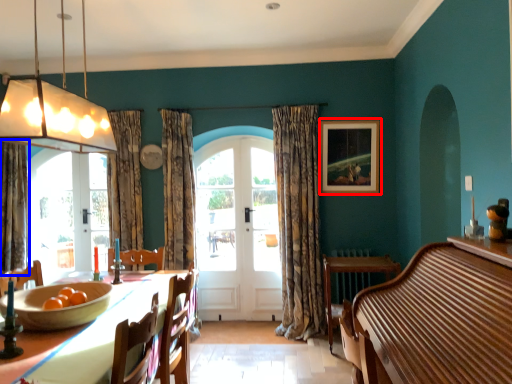
Question: Among these objects, which one is farthest to the camera, picture frame (highlighted by a red box) or curtain (highlighted by a blue box)?

Choices:
 (A) picture frame
 (B) curtain

Answer: (A)